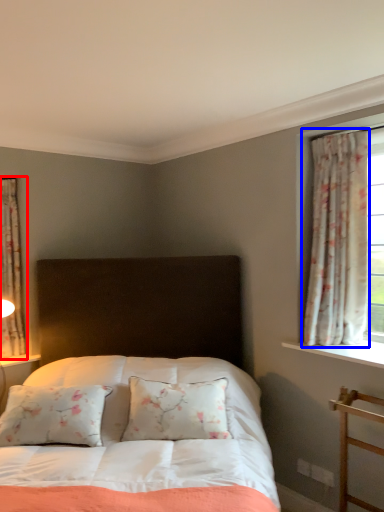
Question: Which object is closer to the camera taking this photo, curtain (highlighted by a red box) or curtain (highlighted by a blue box)?

Choices:
 (A) curtain
 (B) curtain

Answer: (B)